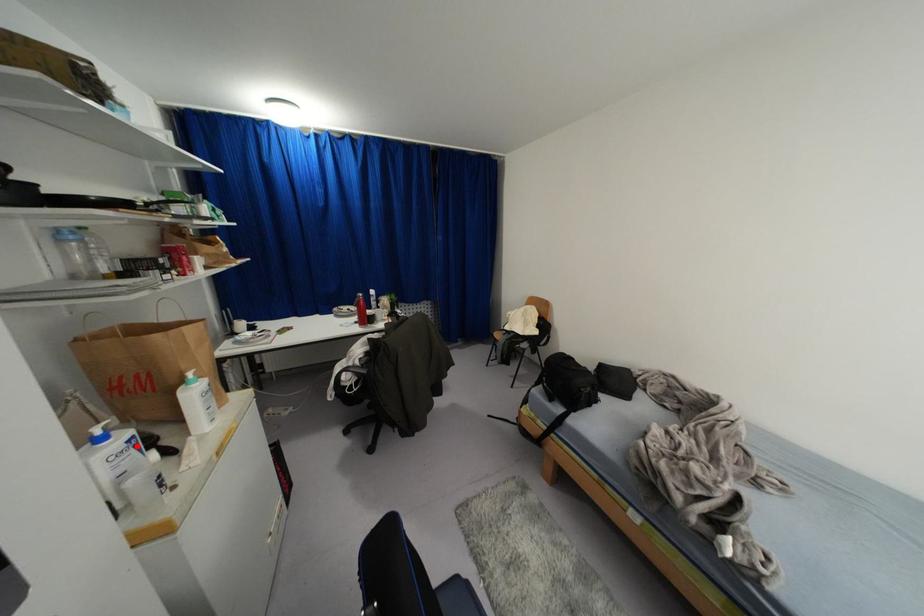
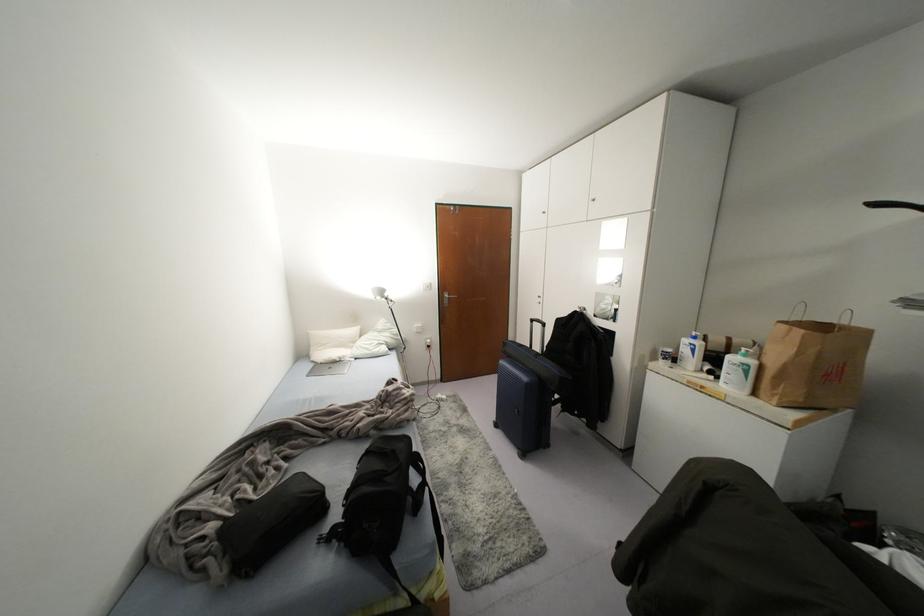
Locate, in the second image, the point that corresponds to the highlighted location in the first image.

(691, 350)